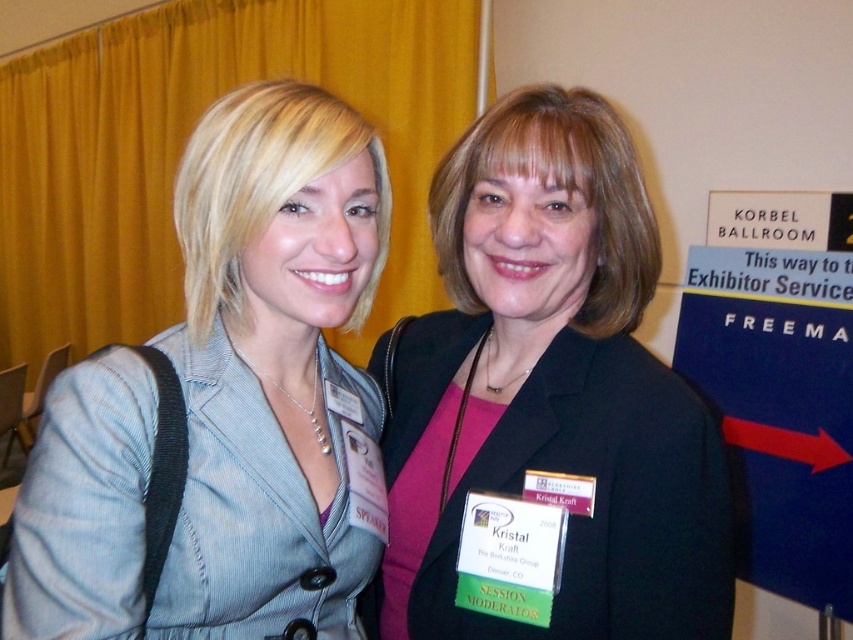
Question: Which object is farther from the camera taking this photo?

Choices:
 (A) matte black blazer at center
 (B) denim jacket at center

Answer: (A)

Question: Among these objects, which one is farthest from the camera?

Choices:
 (A) denim jacket at center
 (B) matte black blazer at center

Answer: (B)

Question: Considering the relative positions of denim jacket at center and matte black blazer at center in the image provided, where is denim jacket at center located with respect to matte black blazer at center?

Choices:
 (A) below
 (B) above

Answer: (B)

Question: Is denim jacket at center smaller than matte black blazer at center?

Choices:
 (A) no
 (B) yes

Answer: (B)

Question: Which point appears farthest from the camera in this image?

Choices:
 (A) (357, 244)
 (B) (720, 532)

Answer: (B)

Question: In this image, where is denim jacket at center located relative to matte black blazer at center?

Choices:
 (A) below
 (B) above

Answer: (B)